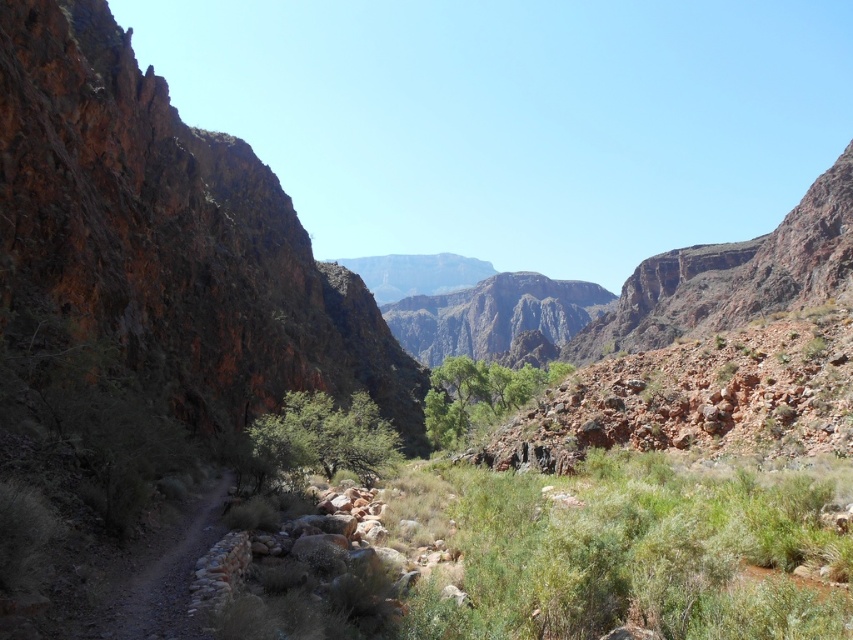
Question: Which of these objects is positioned farthest from the dirt path at left?

Choices:
 (A) green leafy trees at center
 (B) green leafy bush at center

Answer: (A)

Question: Which of the following is the farthest from the observer?

Choices:
 (A) dirt path at left
 (B) rusty rock cliff at left
 (C) green leafy bush at center

Answer: (C)

Question: Is rusty rock cliff at left wider than green leafy bush at center?

Choices:
 (A) no
 (B) yes

Answer: (B)

Question: Can you confirm if rusty rock cliff at left is positioned to the right of green leafy bush at center?

Choices:
 (A) no
 (B) yes

Answer: (A)

Question: Does dirt path at left have a lesser width compared to green leafy trees at center?

Choices:
 (A) yes
 (B) no

Answer: (A)

Question: Which point is closer to the camera?

Choices:
 (A) dirt path at left
 (B) green leafy trees at center
 (C) rusty rock cliff at left
 (D) green leafy bush at center

Answer: (A)